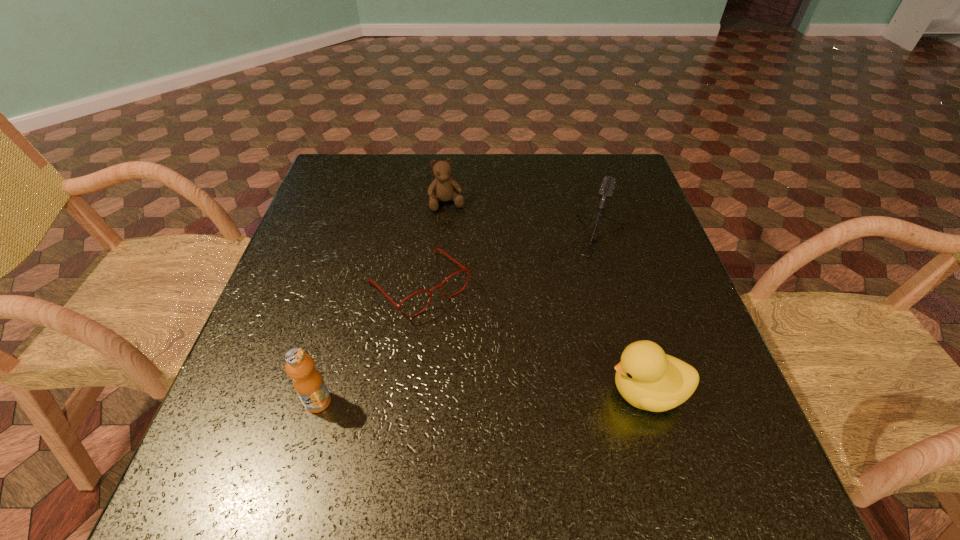
Locate an element on the screen. The height and width of the screenshot is (540, 960). orange juice is located at coordinates (308, 383).

The image size is (960, 540). In order to click on duck in this screenshot , I will do `click(647, 378)`.

The image size is (960, 540). I want to click on the farthest object, so click(441, 189).

This screenshot has width=960, height=540. Identify the location of spectacles. (464, 269).

Identify the location of microphone. Image resolution: width=960 pixels, height=540 pixels. (606, 190).

This screenshot has height=540, width=960. I want to click on vacant space situated on the front-facing side of the duck, so click(x=429, y=392).

Identify the location of free space located 0.250m on the front-facing side of the duck. (468, 392).

You are a GUI agent. You are given a task and a screenshot of the screen. Output one action in this format:
    pyautogui.click(x=<x>, y=<y>)
    Task: Click on the vacant space located on the front-facing side of the duck
    The width and height of the screenshot is (960, 540).
    Given the screenshot: What is the action you would take?
    pyautogui.click(x=507, y=392)

This screenshot has height=540, width=960. In order to click on vacant position located on the front-facing side of the farthest object in this screenshot , I will do click(471, 283).

Where is `vacant space located 0.260m on the front-facing side of the farthest object`? This screenshot has width=960, height=540. vacant space located 0.260m on the front-facing side of the farthest object is located at coordinates (471, 283).